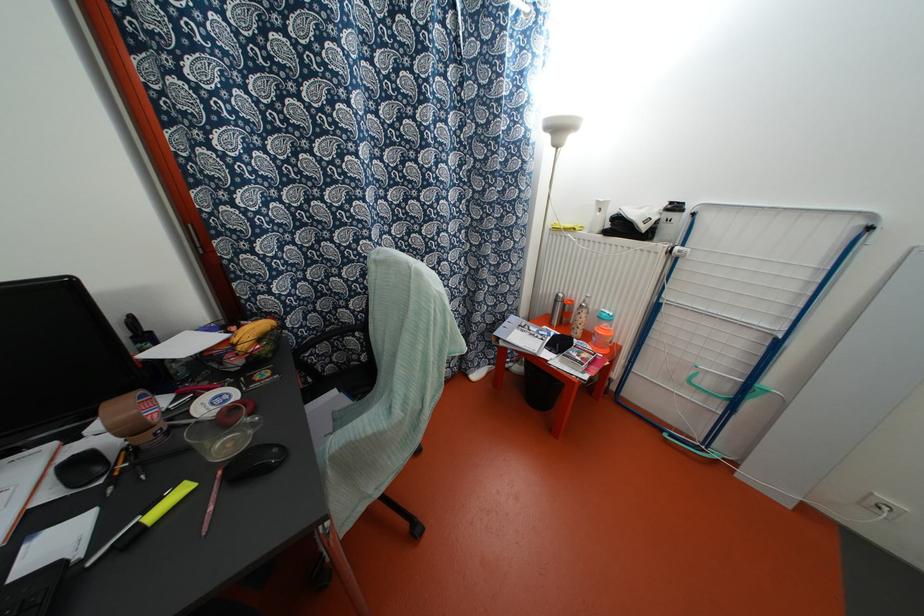
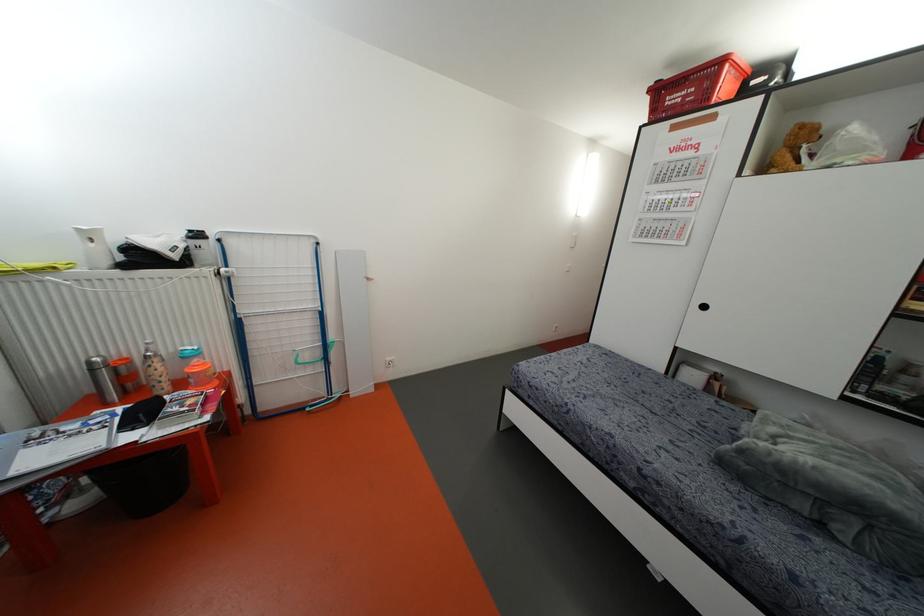
The point at (584, 310) is marked in the first image. Where is the corresponding point in the second image?

(155, 360)